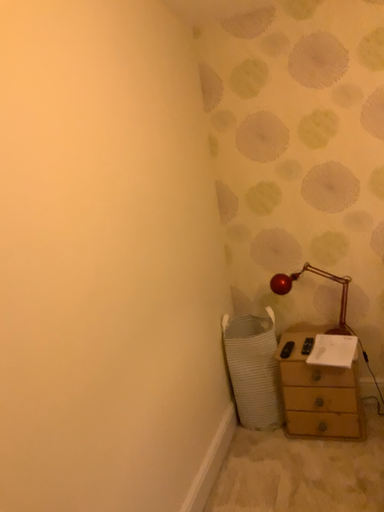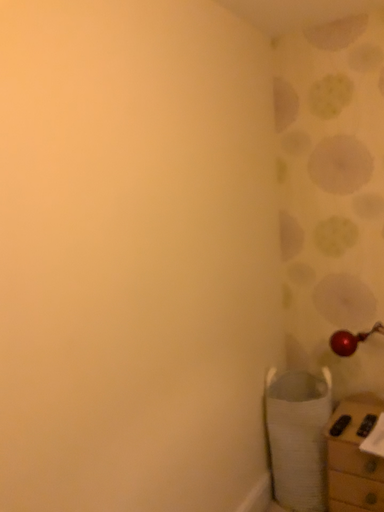
Question: How did the camera likely rotate when shooting the video?

Choices:
 (A) rotated right
 (B) rotated left

Answer: (B)